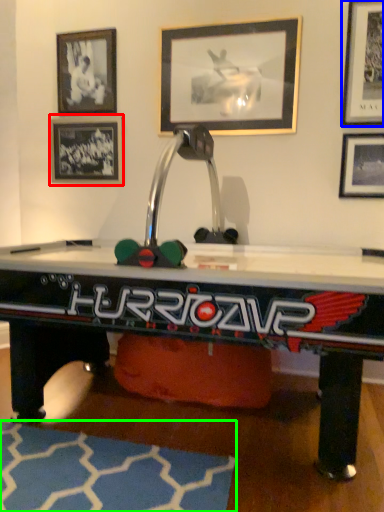
Question: Based on their relative distances, which object is nearer to picture frame (highlighted by a red box)? Choose from picture frame (highlighted by a blue box) and mat (highlighted by a green box).

Choices:
 (A) picture frame
 (B) mat

Answer: (A)